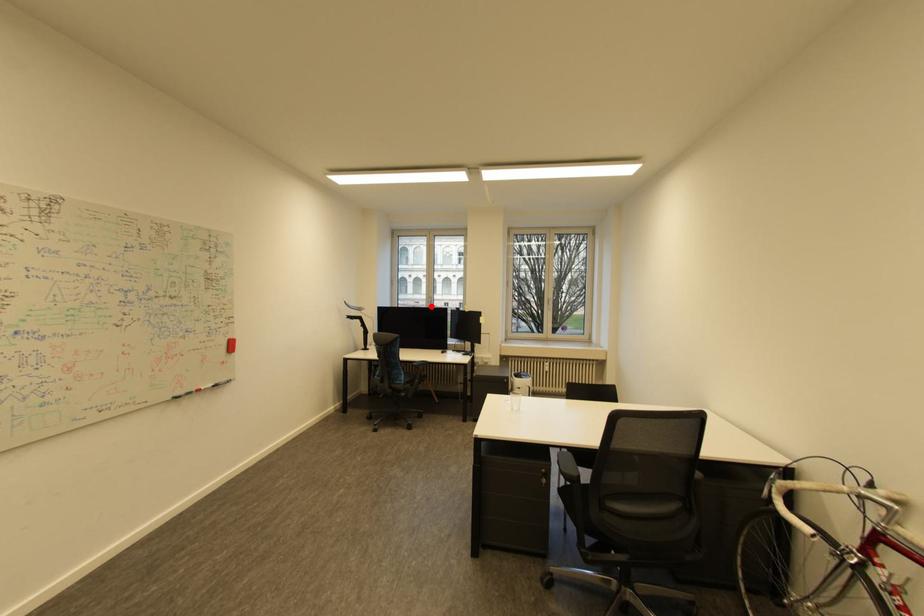
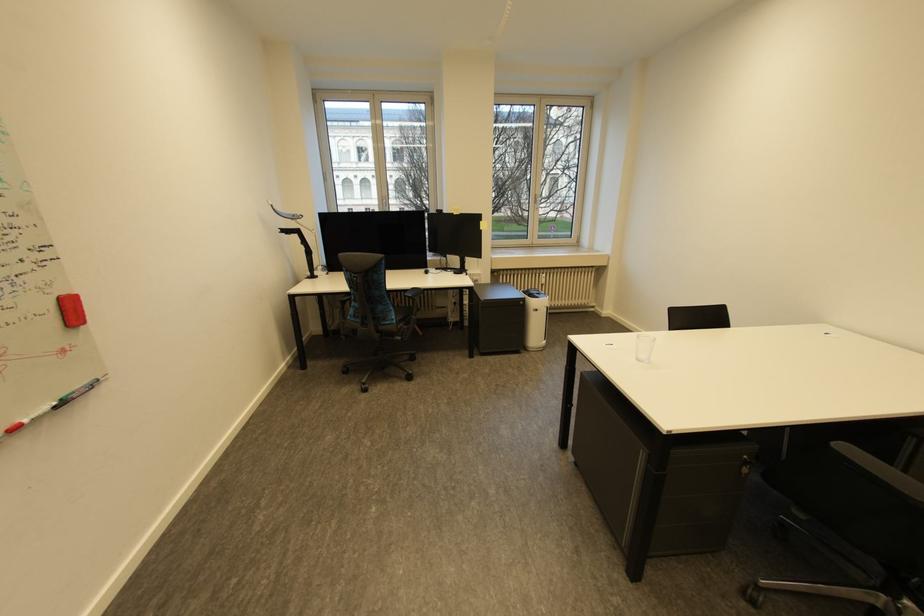
The point at the highlighted location is marked in the first image. Where is the corresponding point in the second image?

(383, 209)